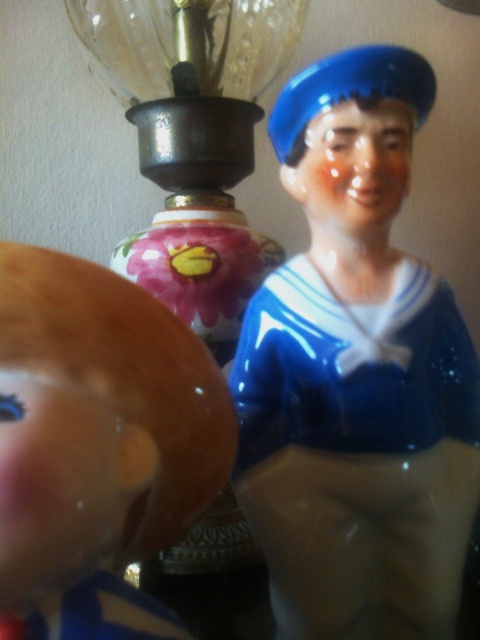
You are arranging a display shelf and want to ensure that the matte brown doll at left is visible. Given that the blue glossy sailor figurine at upper right is currently blocking it, what adjustment should you make?

The matte brown doll at left is currently behind the blue glossy sailor figurine at upper right. To make the matte brown doll at left visible, you should move the blue glossy sailor figurine at upper right to a position in front of or beside the matte brown doll at left so it no longer blocks the view.

You are trying to decide whether to place a small decorative box between the matte brown doll at left and the transparent glass lamp at upper center. Based on their sizes, will the box fit comfortably between them?

The matte brown doll at left is smaller than the transparent glass lamp at upper center. Since the doll is smaller, there should be enough space between them to place the box comfortably.

You are an interior designer arranging a shelf. You have a blue glossy sailor figurine at upper right and a decorative lamp. You need to place a new small vase exactly at the point marked by coordinates point (357,374). Is this point currently occupied by the blue glossy sailor figurine at upper right?

Yes, the point (357,374) is occupied by the blue glossy sailor figurine at upper right as described in the scene.